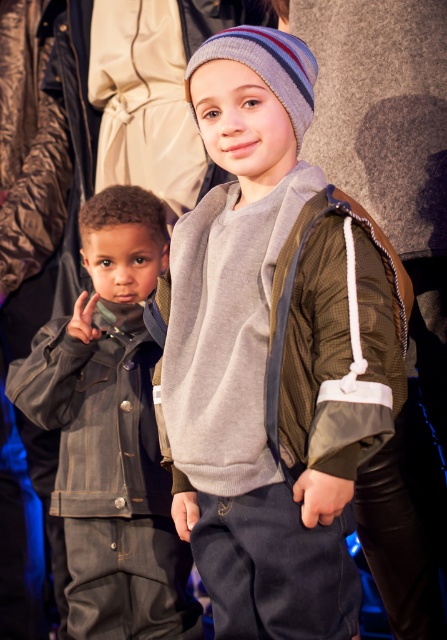
Which is in front, point (127, 470) or point (243, 36)?

Point (243, 36) is more forward.

This screenshot has height=640, width=447. What do you see at coordinates (96, 413) in the screenshot? I see `gray cotton sweatshirt at left` at bounding box center [96, 413].

The width and height of the screenshot is (447, 640). I want to click on gray cotton sweatshirt at left, so click(96, 413).

Is point (198, 275) in front of point (282, 77)?

No.

Who is shorter, gray fleece sweatshirt at center or striped knit beanie at upper center?

Standing shorter between the two is striped knit beanie at upper center.

Who is more distant from viewer, (298, 428) or (266, 48)?

Point (266, 48)

Identify the location of gray fleece sweatshirt at center. The width and height of the screenshot is (447, 640). (275, 339).

Looking at this image, is denim jacket at left positioned at the back of striped knit beanie at upper center?

Yes, denim jacket at left is behind striped knit beanie at upper center.

Does denim jacket at left appear under striped knit beanie at upper center?

Correct, denim jacket at left is located below striped knit beanie at upper center.

Who is more forward, [13,388] or [303,131]?

Point [303,131] is more forward.

You are a GUI agent. You are given a task and a screenshot of the screen. Output one action in this format:
    pyautogui.click(x=<x>, y=<y>)
    Task: Click on the denim jacket at left
    This screenshot has height=640, width=447.
    Given the screenshot: What is the action you would take?
    pyautogui.click(x=112, y=433)